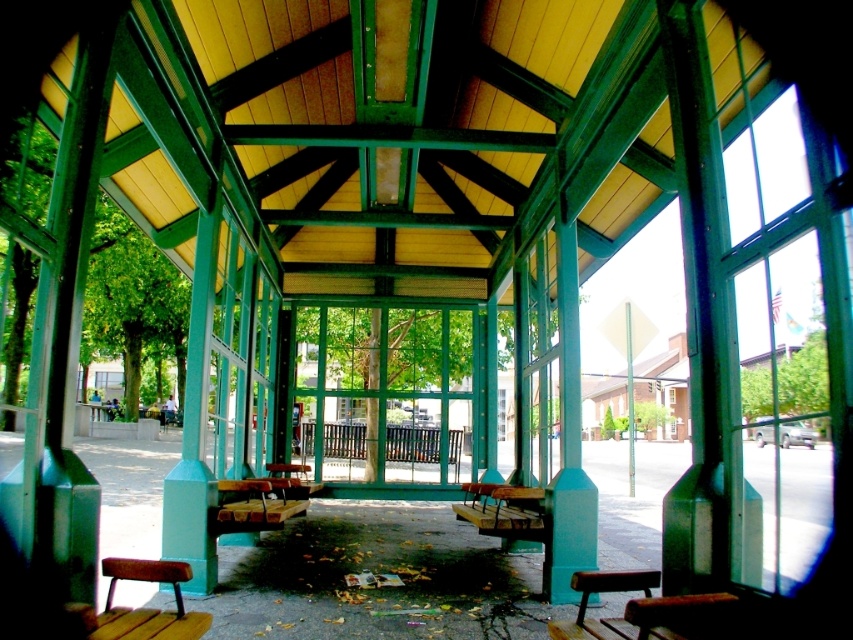
Question: Which point is closer to the camera taking this photo?

Choices:
 (A) (752, 358)
 (B) (107, 573)

Answer: (B)

Question: Does clear glass window at right appear over wooden park bench at lower left?

Choices:
 (A) yes
 (B) no

Answer: (A)

Question: Which point is farther to the camera?

Choices:
 (A) clear glass window at right
 (B) wooden bench at lower right
 (C) wooden park bench at lower left

Answer: (A)

Question: Is clear glass window at right below wooden bench at lower right?

Choices:
 (A) yes
 (B) no

Answer: (B)

Question: Which of the following is the farthest from the observer?

Choices:
 (A) (779, 227)
 (B) (102, 612)

Answer: (B)

Question: Does wooden bench at lower right have a smaller size compared to wooden park bench at lower left?

Choices:
 (A) yes
 (B) no

Answer: (A)